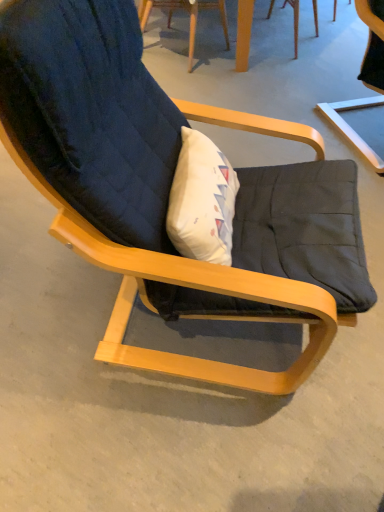
Question: From their relative heights in the image, would you say matte black cushion at center, which ranks as the second chair in left-to-right order, is taller or shorter than wooden table at upper center?

Choices:
 (A) short
 (B) tall

Answer: (B)

Question: Is matte black cushion at center, which is counted as the 1th chair, starting from the right, inside the boundaries of wooden table at upper center, or outside?

Choices:
 (A) inside
 (B) outside

Answer: (B)

Question: Which object is positioned closest to the wooden table at upper center?

Choices:
 (A) dark blue fabric chair at upper center, placed as the first chair when sorted from left to right
 (B) matte black cushion at center, which is counted as the 1th chair, starting from the right

Answer: (A)

Question: Estimate the real-world distances between objects in this image. Which object is farther from the matte black cushion at center, which ranks as the second chair in left-to-right order?

Choices:
 (A) wooden table at upper center
 (B) dark blue fabric chair at upper center, placed as the first chair when sorted from left to right

Answer: (B)